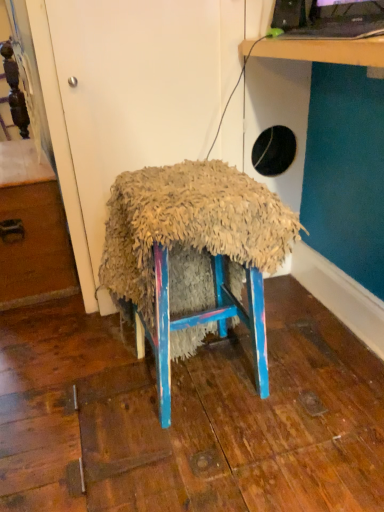
Question: Is fuzzy fabric stool at center looking in the opposite direction of wooden table at upper right?

Choices:
 (A) yes
 (B) no

Answer: (B)

Question: Is fuzzy fabric stool at center in front of wooden table at upper right?

Choices:
 (A) no
 (B) yes

Answer: (A)

Question: Considering the relative sizes of fuzzy fabric stool at center and wooden table at upper right in the image provided, is fuzzy fabric stool at center taller than wooden table at upper right?

Choices:
 (A) yes
 (B) no

Answer: (A)

Question: Does fuzzy fabric stool at center appear on the left side of wooden table at upper right?

Choices:
 (A) yes
 (B) no

Answer: (A)

Question: From a real-world perspective, is fuzzy fabric stool at center over wooden table at upper right?

Choices:
 (A) no
 (B) yes

Answer: (A)

Question: Can you confirm if fuzzy fabric stool at center is smaller than wooden table at upper right?

Choices:
 (A) yes
 (B) no

Answer: (B)

Question: Considering the relative sizes of black glossy desktop computer at upper right and wooden drawer at left in the image provided, is black glossy desktop computer at upper right shorter than wooden drawer at left?

Choices:
 (A) yes
 (B) no

Answer: (A)

Question: Is black glossy desktop computer at upper right to the left of wooden drawer at left from the viewer's perspective?

Choices:
 (A) no
 (B) yes

Answer: (A)

Question: Could you tell me if black glossy desktop computer at upper right is turned towards wooden drawer at left?

Choices:
 (A) no
 (B) yes

Answer: (A)

Question: Considering the relative positions of black glossy desktop computer at upper right and wooden drawer at left in the image provided, is black glossy desktop computer at upper right behind wooden drawer at left?

Choices:
 (A) no
 (B) yes

Answer: (A)

Question: From a real-world perspective, is black glossy desktop computer at upper right on wooden drawer at left?

Choices:
 (A) yes
 (B) no

Answer: (A)

Question: Is wooden drawer at left completely or partially inside black glossy desktop computer at upper right?

Choices:
 (A) no
 (B) yes

Answer: (A)

Question: Is fuzzy fabric stool at center taller than black glossy desktop computer at upper right?

Choices:
 (A) yes
 (B) no

Answer: (A)